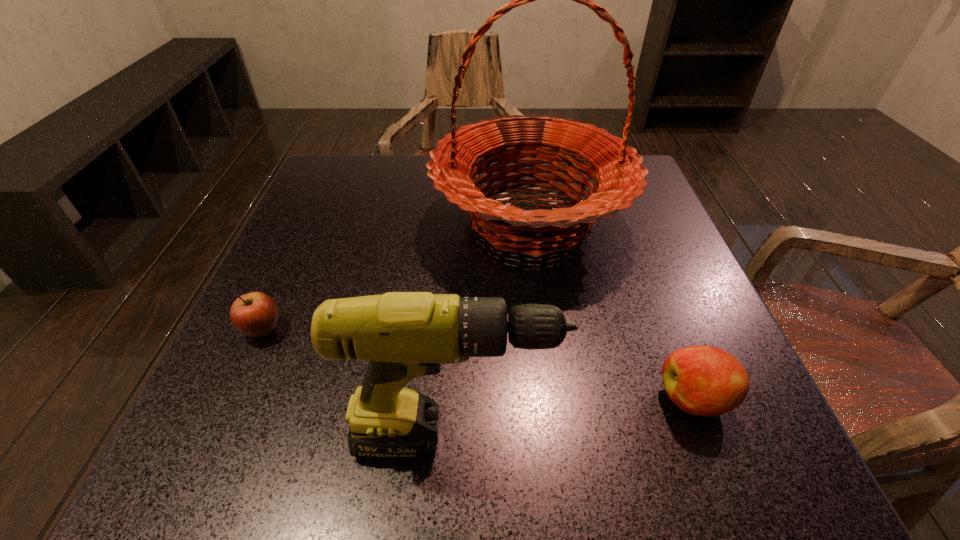
I want to click on free space between the right apple and the drill, so (574, 418).

You are a GUI agent. You are given a task and a screenshot of the screen. Output one action in this format:
    pyautogui.click(x=<x>, y=<y>)
    Task: Click on the empty location between the second tallest object and the right apple
    
    Given the screenshot: What is the action you would take?
    pyautogui.click(x=574, y=418)

Where is `object that is the closest one to the tallest object`? This screenshot has width=960, height=540. object that is the closest one to the tallest object is located at coordinates (706, 381).

The height and width of the screenshot is (540, 960). What are the coordinates of `the third closest object relative to the left apple` in the screenshot? It's located at (706, 381).

The height and width of the screenshot is (540, 960). I want to click on vacant position in the image that satisfies the following two spatial constraints: 1. on the front side of the leftmost object; 2. on the right side of the nearer apple, so click(x=232, y=399).

Find the location of a particular element. free location that satisfies the following two spatial constraints: 1. on the front side of the tallest object; 2. on the right side of the nearer apple is located at coordinates (555, 399).

Identify the location of free location that satisfies the following two spatial constraints: 1. on the back side of the tallest object; 2. on the left side of the farther apple. This screenshot has height=540, width=960. (314, 218).

At what (x,y) coordinates should I click in order to perform the action: click on free spot that satisfies the following two spatial constraints: 1. on the back side of the tallest object; 2. on the left side of the leftmost object. Please return your answer as a coordinate pair (x, y). Looking at the image, I should click on (314, 218).